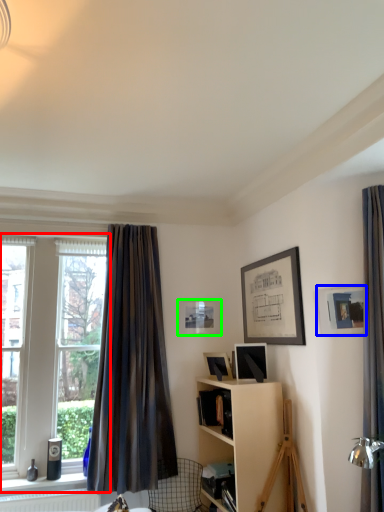
Question: Which is farther away from window (highlighted by a red box)? picture frame (highlighted by a blue box) or picture frame (highlighted by a green box)?

Choices:
 (A) picture frame
 (B) picture frame

Answer: (A)